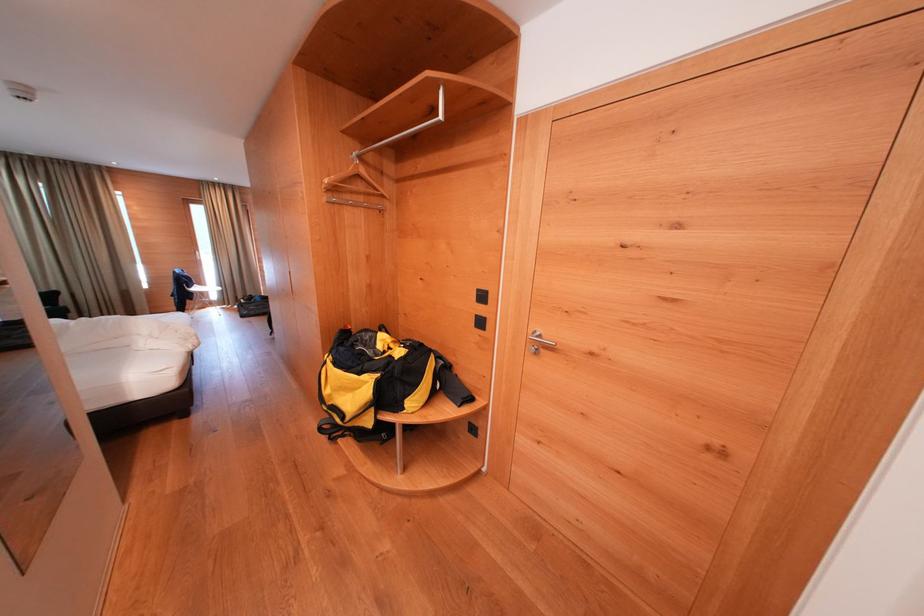
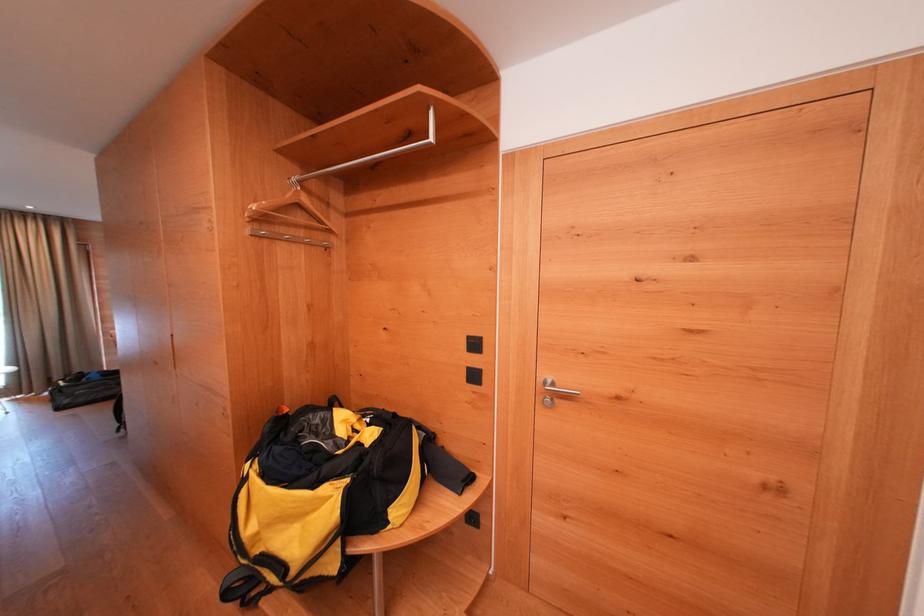
Locate, in the second image, the point that corresponds to [444,120] in the first image.

(434, 142)